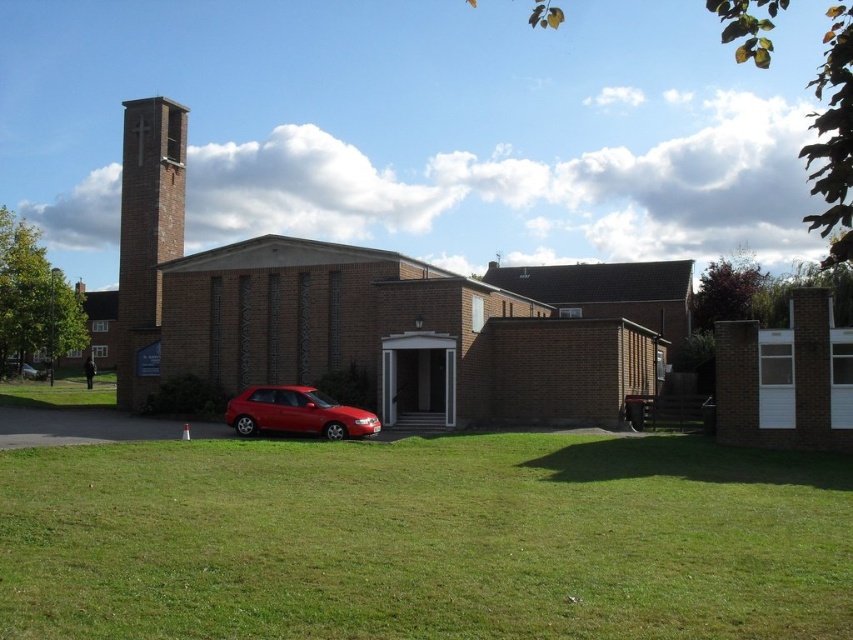
Does green grass at lower center appear on the right side of shiny red hatchback at lower left?

Indeed, green grass at lower center is positioned on the right side of shiny red hatchback at lower left.

Who is more forward, (543, 499) or (277, 416)?

Point (543, 499) is in front.

Is point (144, 456) positioned in front of point (273, 428)?

Yes, point (144, 456) is closer to viewer.

This screenshot has height=640, width=853. Identify the location of green grass at lower center. (425, 540).

Does green grass at lower center appear over brick church at center?

No, green grass at lower center is not above brick church at center.

Between green grass at lower center and brick church at center, which one is positioned higher?

brick church at center is above.

Who is more distant from viewer, (0, 540) or (334, 332)?

Positioned behind is point (334, 332).

Image resolution: width=853 pixels, height=640 pixels. In order to click on green grass at lower center in this screenshot , I will do `click(425, 540)`.

Does green grass at lower center have a greater width compared to brick bell tower at left?

No.

Is green grass at lower center above brick bell tower at left?

No, green grass at lower center is not above brick bell tower at left.

The image size is (853, 640). Describe the element at coordinates (425, 540) in the screenshot. I see `green grass at lower center` at that location.

Locate an element on the screen. This screenshot has width=853, height=640. green grass at lower center is located at coordinates (425, 540).